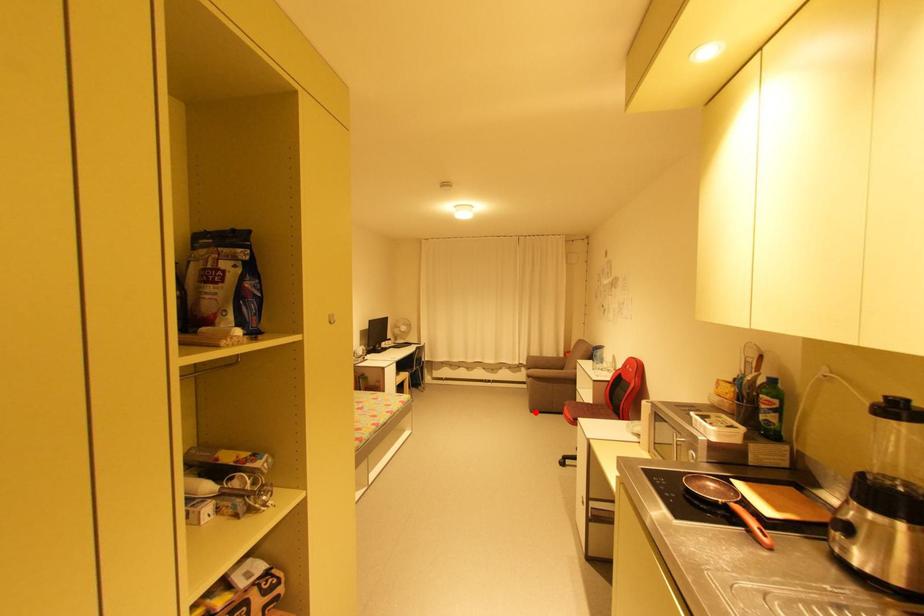
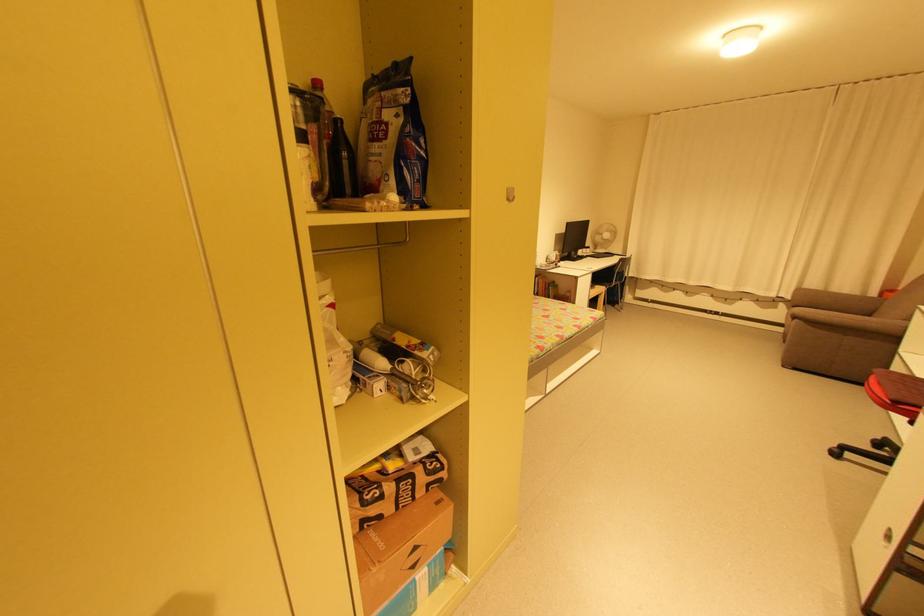
The point at the highlighted location is marked in the first image. Where is the corresponding point in the second image?

(788, 367)